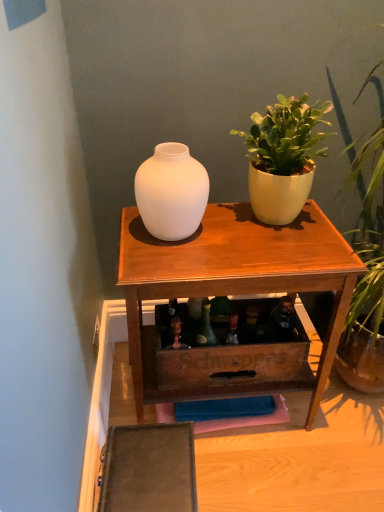
Identify the location of free location in front of matte white vase at upper center. (254, 474).